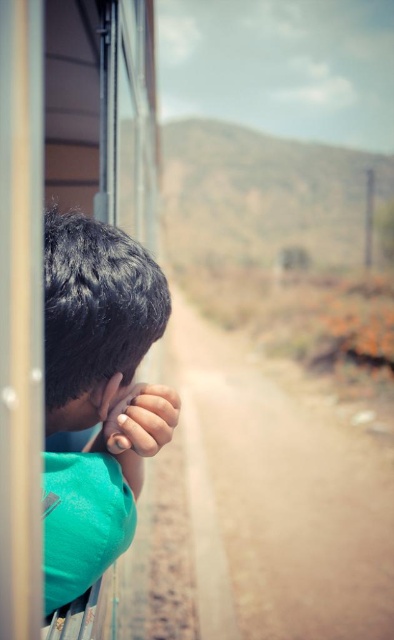
Question: Can you confirm if dark brown hair at left is positioned to the right of nail polish painted fingernails at lower left?

Choices:
 (A) yes
 (B) no

Answer: (B)

Question: Is dark brown hair at left positioned at the back of nail polish painted fingernails at lower left?

Choices:
 (A) no
 (B) yes

Answer: (A)

Question: Is dark brown hair at left wider than nail polish painted fingernails at lower left?

Choices:
 (A) yes
 (B) no

Answer: (A)

Question: Which object appears closest to the camera in this image?

Choices:
 (A) dark brown hair at left
 (B) nail polish painted fingernails at lower left

Answer: (A)